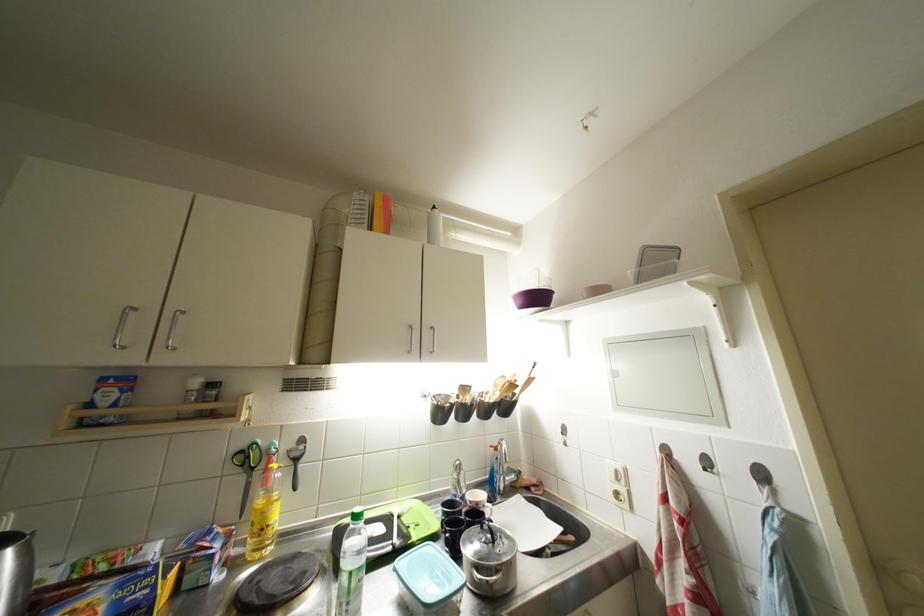
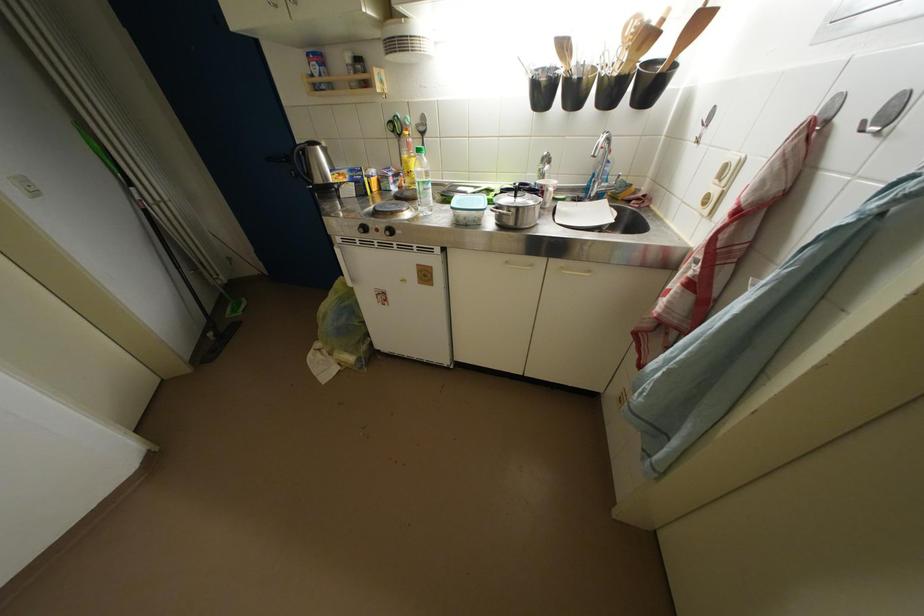
Locate, in the second image, the point that corresponds to point (406, 522) in the first image.

(495, 193)